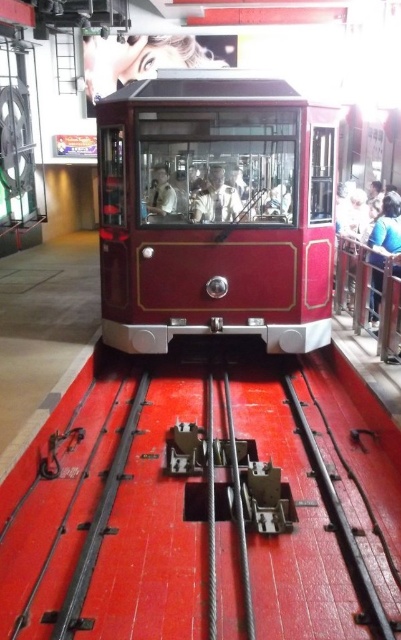
Question: Considering the relative positions of metallic red train track at center and shiny red tram at center in the image provided, where is metallic red train track at center located with respect to shiny red tram at center?

Choices:
 (A) right
 (B) left

Answer: (B)

Question: Can you confirm if metallic red train track at center is wider than shiny red tram at center?

Choices:
 (A) no
 (B) yes

Answer: (B)

Question: Can you confirm if metallic red train track at center is wider than shiny red tram at center?

Choices:
 (A) yes
 (B) no

Answer: (A)

Question: Which point is farther to the camera?

Choices:
 (A) shiny red tram at center
 (B) metallic red train track at center

Answer: (A)